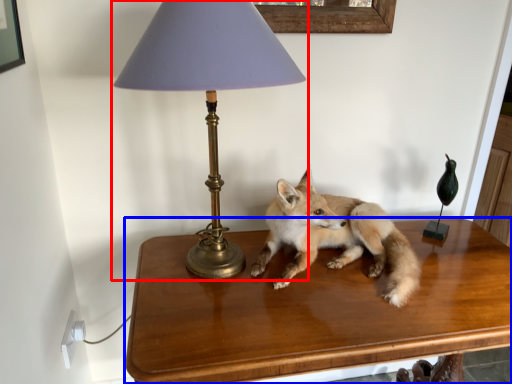
Question: Which object is further to the camera taking this photo, lamp (highlighted by a red box) or table (highlighted by a blue box)?

Choices:
 (A) lamp
 (B) table

Answer: (B)